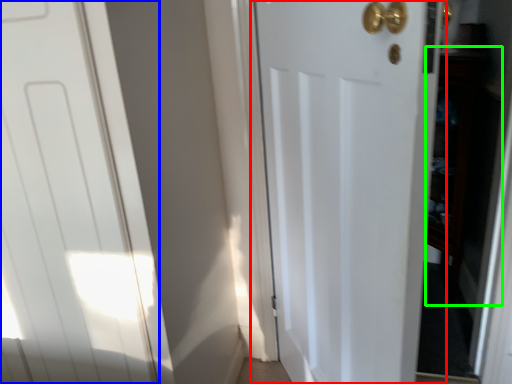
Question: Based on their relative distances, which object is nearer to door (highlighted by a red box)? Choose from door (highlighted by a blue box) and cabinetry (highlighted by a green box).

Choices:
 (A) door
 (B) cabinetry

Answer: (A)